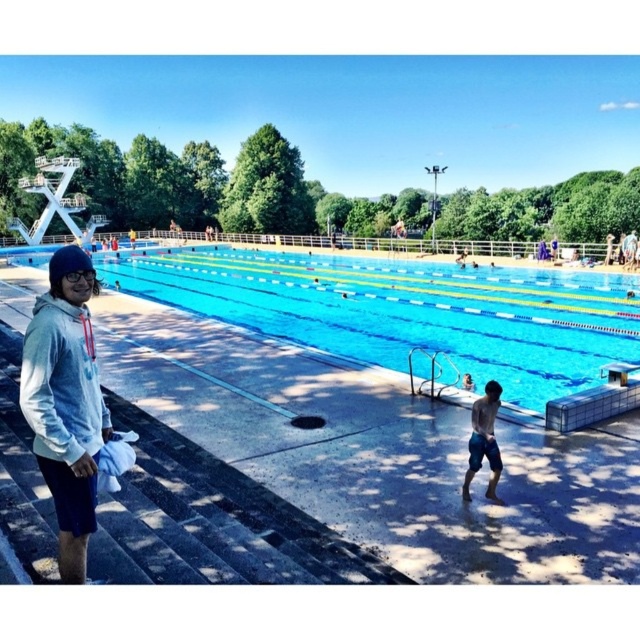
Question: Can you confirm if light blue hoodie at left is thinner than blue denim shorts at lower right?

Choices:
 (A) yes
 (B) no

Answer: (B)

Question: Does light blue hoodie at left appear under transparent plastic goggles at left?

Choices:
 (A) yes
 (B) no

Answer: (A)

Question: Estimate the real-world distances between objects in this image. Which object is farther from the blue denim shorts at lower right?

Choices:
 (A) light blue hoodie at left
 (B) blue smooth water at center

Answer: (B)

Question: In this image, where is blue smooth water at center located relative to light blue hoodie at left?

Choices:
 (A) left
 (B) right

Answer: (A)

Question: Which object is closer to the camera taking this photo?

Choices:
 (A) light blue hoodie at left
 (B) blue denim shorts at lower right
 (C) blue smooth water at center
 (D) transparent plastic goggles at left

Answer: (A)

Question: Which object is the closest to the transparent plastic goggles at left?

Choices:
 (A) blue smooth water at center
 (B) light blue hoodie at left
 (C) blue denim shorts at lower right

Answer: (B)